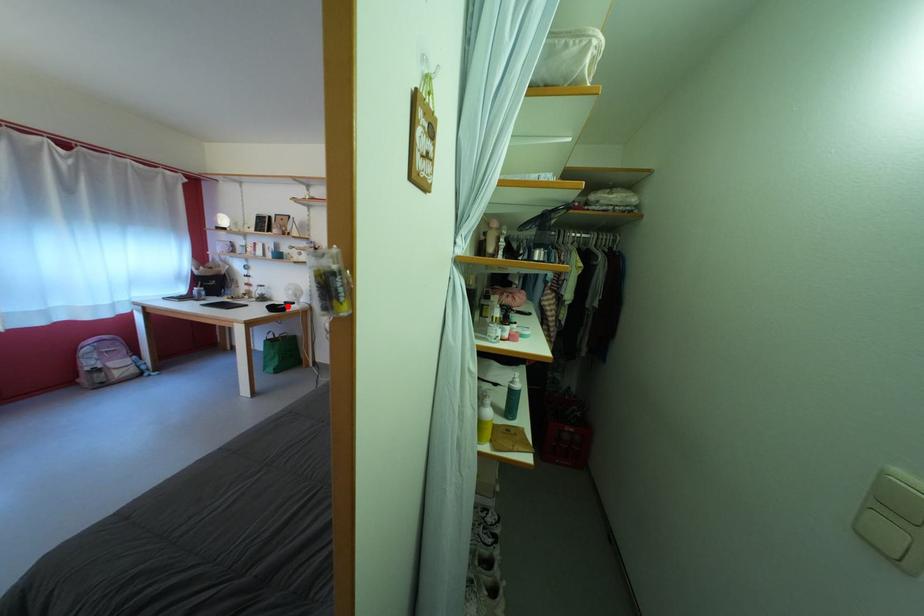
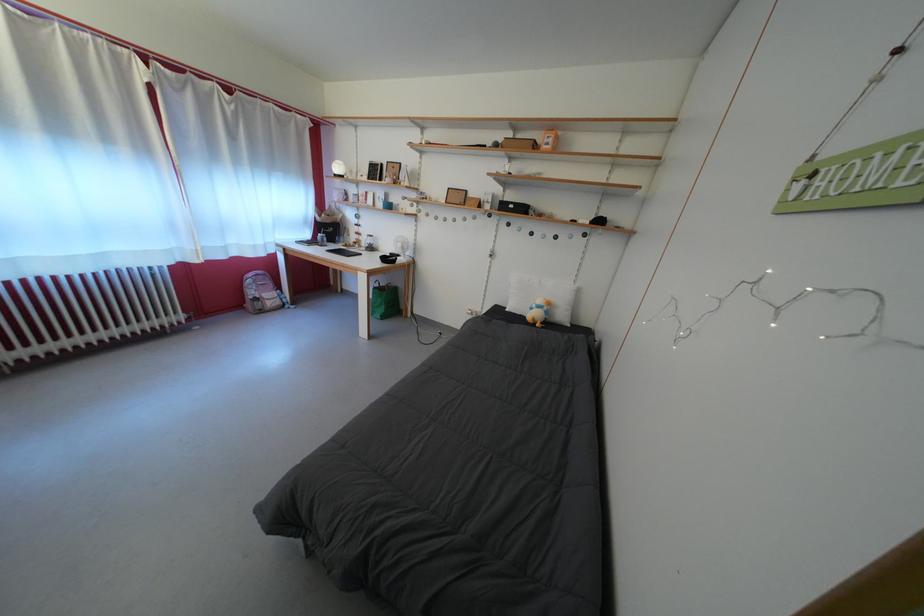
Where in the second image is the point corresponding to the highlighted location from the first image?

(394, 257)